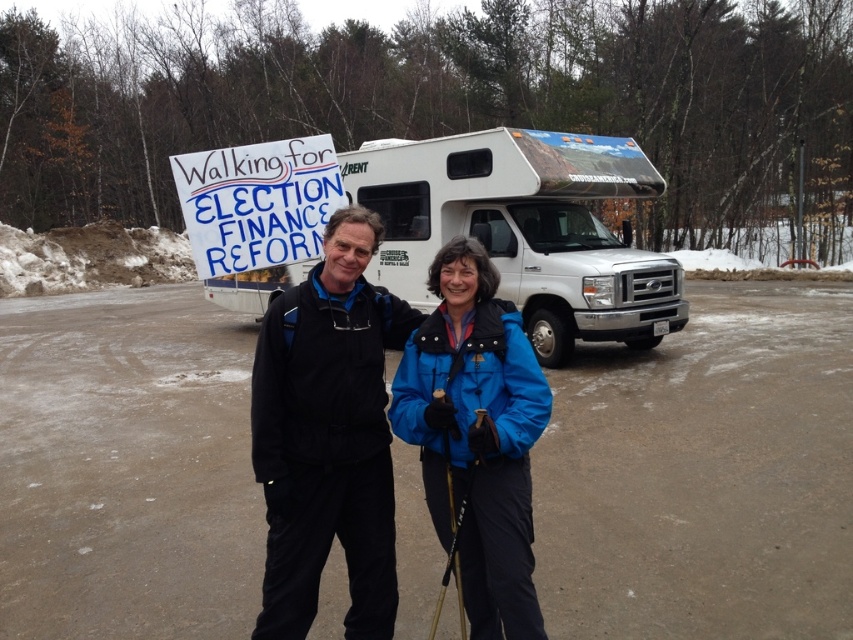
Is matte black jacket at center thinner than blue synthetic jacket at center?

No.

Who is taller, matte black jacket at center or blue synthetic jacket at center?

With more height is matte black jacket at center.

Is point (357, 561) less distant than point (517, 456)?

No, (357, 561) is further to viewer.

Where is `matte black jacket at center`? The height and width of the screenshot is (640, 853). matte black jacket at center is located at coordinates (328, 435).

Is white vinyl recreational vehicle at upper center taller than matte black jacket at center?

In fact, white vinyl recreational vehicle at upper center may be shorter than matte black jacket at center.

Does white vinyl recreational vehicle at upper center appear under matte black jacket at center?

No.

Identify the location of white vinyl recreational vehicle at upper center. The image size is (853, 640). (524, 228).

Is blue synthetic jacket at center further to the viewer compared to black plastic ski pole at center?

No, it is not.

Is point (425, 326) positioned before point (453, 560)?

No, (425, 326) is behind (453, 560).

Is point (467, 262) farther from camera compared to point (445, 576)?

No, it is not.

What are the coordinates of `blue synthetic jacket at center` in the screenshot? It's located at (476, 435).